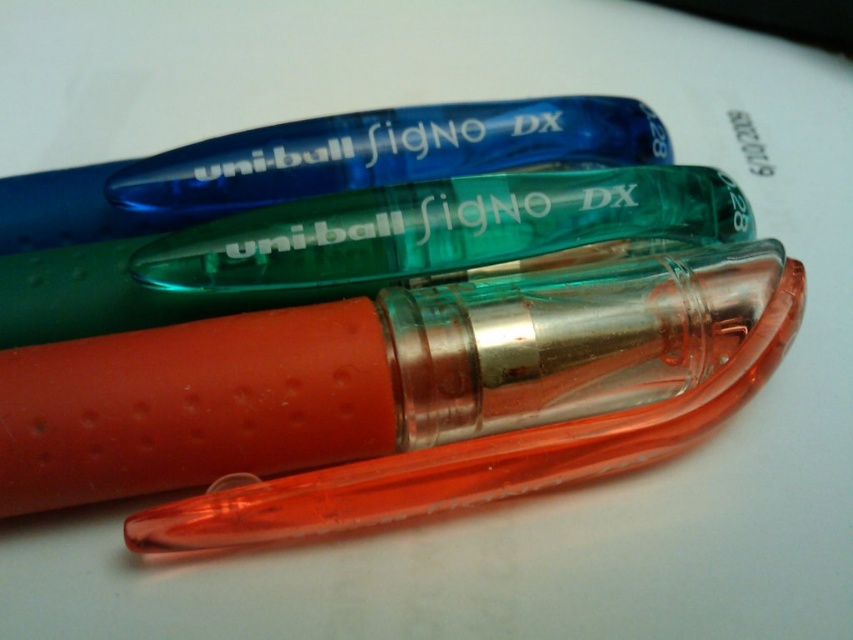
Question: Does translucent orange pen at center have a greater width compared to translucent green pen at center?

Choices:
 (A) no
 (B) yes

Answer: (B)

Question: Is translucent orange pen at center bigger than translucent green pen at center?

Choices:
 (A) no
 (B) yes

Answer: (B)

Question: Observing the image, what is the correct spatial positioning of translucent orange pen at center in reference to translucent green pen at center?

Choices:
 (A) right
 (B) left

Answer: (B)

Question: Which of the following is the farthest from the observer?

Choices:
 (A) (460, 221)
 (B) (294, 392)

Answer: (A)